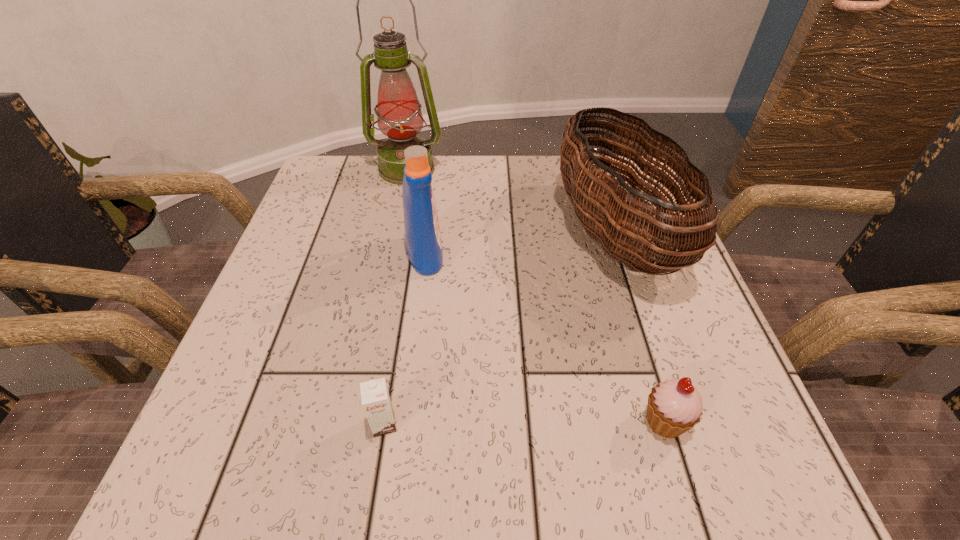
At what (x,y) coordinates should I click in order to perform the action: click on blank space at the far edge of the desktop. Please return your answer as a coordinate pair (x, y). Looking at the image, I should click on (506, 161).

The height and width of the screenshot is (540, 960). In the image, there is a desktop. In order to click on vacant space at the left edge in this screenshot , I will do `click(304, 394)`.

This screenshot has height=540, width=960. Identify the location of vacant area at the right edge of the desktop. (681, 336).

The image size is (960, 540). Find the location of `vacant position at the far left corner of the desktop`. vacant position at the far left corner of the desktop is located at coordinates (348, 193).

At what (x,y) coordinates should I click in order to perform the action: click on vacant space at the near right corner of the desktop. Please return your answer as a coordinate pair (x, y). This screenshot has height=540, width=960. Looking at the image, I should click on (772, 474).

Identify the location of unoccupied area between the detergent and the third shortest object. Image resolution: width=960 pixels, height=540 pixels. (519, 243).

Identify the location of blank region between the chocolate milk and the detergent. point(405,339).

You are a GUI agent. You are given a task and a screenshot of the screen. Output one action in this format:
    pyautogui.click(x=<x>, y=<y>)
    Task: Click on the free area in between the chocolate milk and the tallest object
    Image resolution: width=960 pixels, height=540 pixels.
    Given the screenshot: What is the action you would take?
    pyautogui.click(x=396, y=296)

Find the location of a particular element. free space between the second tallest object and the chocolate milk is located at coordinates (405, 339).

The width and height of the screenshot is (960, 540). I want to click on free spot between the tallest object and the basket, so click(x=510, y=201).